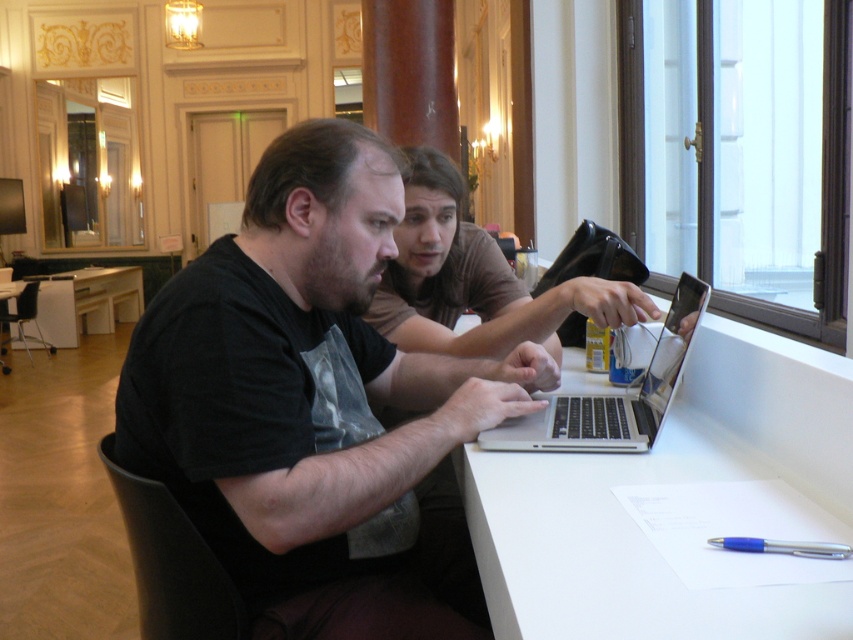
Question: Which object is closer to the camera taking this photo?

Choices:
 (A) black matte shirt at center
 (B) white matte table at center

Answer: (B)

Question: Does white matte table at center appear under brown casual shirt at center?

Choices:
 (A) no
 (B) yes

Answer: (B)

Question: Can you confirm if black matte shirt at center is wider than brown casual shirt at center?

Choices:
 (A) no
 (B) yes

Answer: (B)

Question: Is white matte table at center above brown casual shirt at center?

Choices:
 (A) no
 (B) yes

Answer: (A)

Question: Estimate the real-world distances between objects in this image. Which object is closer to the silver metallic laptop at center?

Choices:
 (A) brown casual shirt at center
 (B) white glossy table at center
 (C) white matte table at center
 (D) black matte shirt at center

Answer: (C)

Question: Among these objects, which one is farthest from the camera?

Choices:
 (A) white matte table at center
 (B) black matte shirt at center
 (C) white glossy table at center
 (D) brown casual shirt at center

Answer: (C)